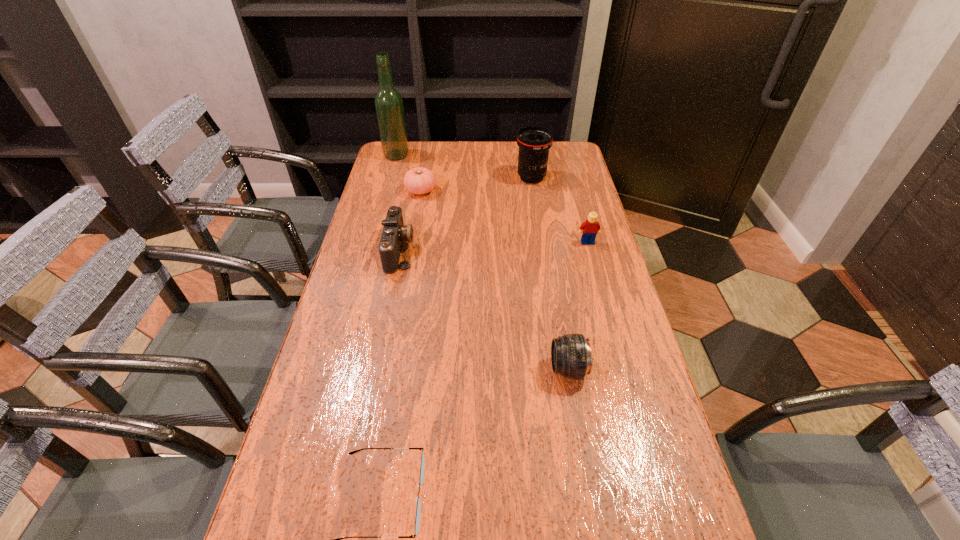
Locate an element on the screen. the tallest object is located at coordinates (389, 108).

Locate an element on the screen. the farthest object is located at coordinates (389, 108).

Locate an element on the screen. This screenshot has height=540, width=960. the farther telephoto lens is located at coordinates (534, 142).

You are a GUI agent. You are given a task and a screenshot of the screen. Output one action in this format:
    pyautogui.click(x=<x>, y=<y>)
    Task: Click on the taller telephoto lens
    The width and height of the screenshot is (960, 540).
    Given the screenshot: What is the action you would take?
    pyautogui.click(x=534, y=142)

What are the coordinates of `Lego` in the screenshot? It's located at (591, 228).

Where is `camera`? camera is located at coordinates (394, 232).

The height and width of the screenshot is (540, 960). In order to click on the second nearest object in this screenshot , I will do `click(571, 357)`.

The height and width of the screenshot is (540, 960). Find the location of `the nearer telephoto lens`. the nearer telephoto lens is located at coordinates (571, 357).

I want to click on tomato, so click(x=419, y=180).

Identify the location of blank space located on the front of the tallest object. (382, 207).